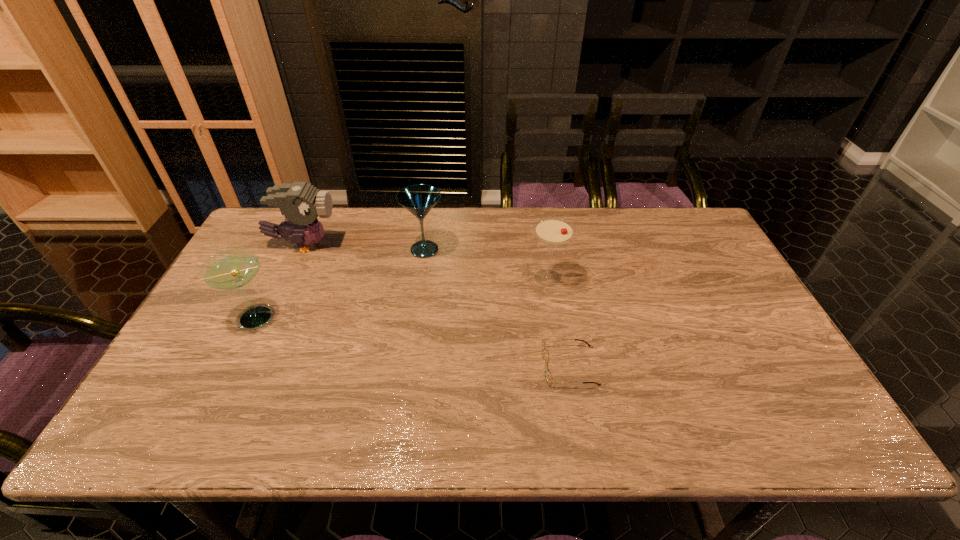
At what (x,y) coordinates should I click in order to perform the action: click on bird. Please return your answer as a coordinate pair (x, y). Image resolution: width=960 pixels, height=540 pixels. Looking at the image, I should click on (300, 202).

Locate an element on the screen. the farthest martini is located at coordinates coord(418,199).

Image resolution: width=960 pixels, height=540 pixels. I want to click on the second martini from right to left, so click(x=418, y=199).

The image size is (960, 540). I want to click on the leftmost martini, so click(230, 269).

You are a GUI agent. You are given a task and a screenshot of the screen. Output one action in this format:
    pyautogui.click(x=<x>, y=<y>)
    Task: Click on the nearest martini
    
    Given the screenshot: What is the action you would take?
    pyautogui.click(x=230, y=269)

Where is `the second nearest martini`? Image resolution: width=960 pixels, height=540 pixels. the second nearest martini is located at coordinates (553, 231).

Image resolution: width=960 pixels, height=540 pixels. Find the location of `the third nearest object`. the third nearest object is located at coordinates (553, 231).

Identify the location of spectacles. This screenshot has height=540, width=960. (546, 371).

Image resolution: width=960 pixels, height=540 pixels. Identify the location of the shortest object. (546, 371).

Find the location of a particular element. vacant area situated 0.070m at the beak of the bird is located at coordinates (361, 245).